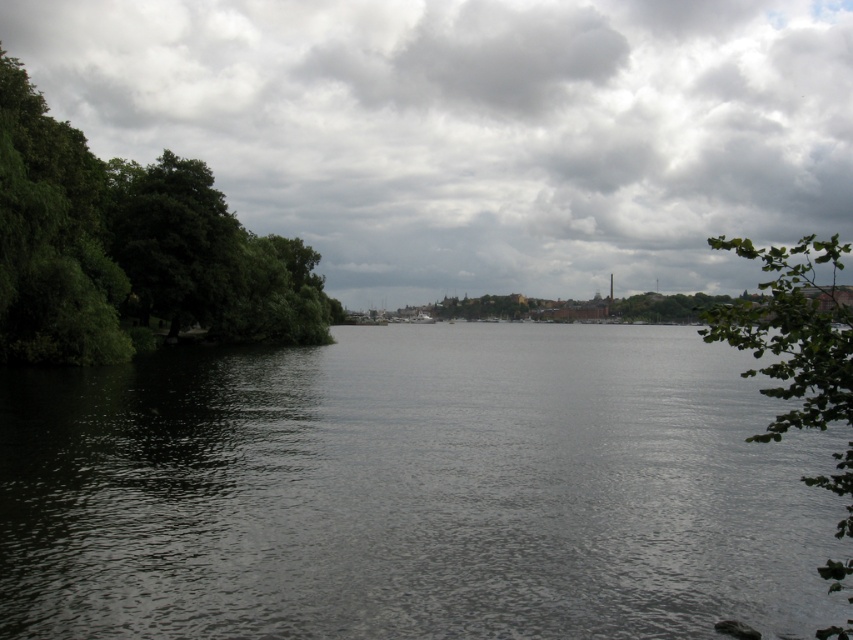
Who is positioned more to the right, dark water at center or cloudy sky at upper center?

Positioned to the right is dark water at center.

Who is taller, dark water at center or cloudy sky at upper center?

Standing taller between the two is cloudy sky at upper center.

Who is more distant from viewer, (465, 388) or (779, 198)?

The point (779, 198) is more distant.

At what (x,y) coordinates should I click in order to perform the action: click on dark water at center. Please return your answer as a coordinate pair (x, y). This screenshot has width=853, height=640. Looking at the image, I should click on (412, 490).

Which is below, green leafy trees at left or green leafy branch at right?

green leafy trees at left is lower down.

Does green leafy trees at left have a lesser width compared to green leafy branch at right?

Correct, green leafy trees at left's width is less than green leafy branch at right's.

Who is more distant from viewer, [213,193] or [720,330]?

The point [213,193] is behind.

The width and height of the screenshot is (853, 640). Find the location of `green leafy trees at left`. green leafy trees at left is located at coordinates (131, 250).

Which is more to the left, dark water at center or green leafy trees at left?

From the viewer's perspective, green leafy trees at left appears more on the left side.

In the scene shown: Which is more to the right, dark water at center or green leafy trees at left?

Positioned to the right is dark water at center.

Who is more forward, (807,502) or (85,300)?

Point (807,502) is in front.

Locate an element on the screen. dark water at center is located at coordinates (412, 490).